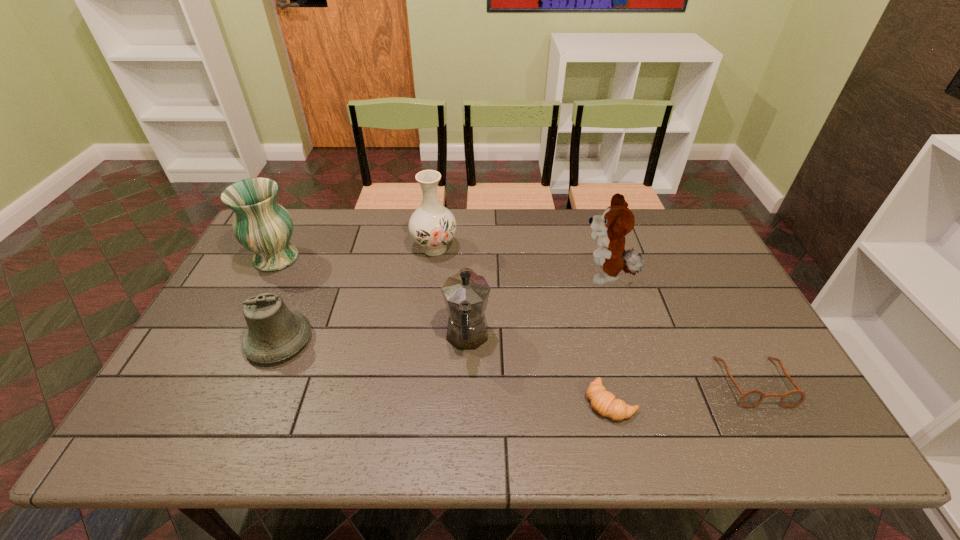
Identify the location of the right vase. (432, 226).

At what (x,y) coordinates should I click in order to perform the action: click on puppy. Please return your answer as a coordinate pair (x, y). Looking at the image, I should click on (610, 229).

What are the coordinates of `the left vase` in the screenshot? It's located at (261, 225).

Locate an element on the screen. Image resolution: width=960 pixels, height=540 pixels. coffeepot is located at coordinates (466, 294).

The height and width of the screenshot is (540, 960). What are the coordinates of `bell` in the screenshot? It's located at (274, 333).

The width and height of the screenshot is (960, 540). In order to click on the rightmost object in this screenshot , I will do `click(751, 398)`.

This screenshot has height=540, width=960. What are the coordinates of `the shortest object` in the screenshot? It's located at (604, 402).

The width and height of the screenshot is (960, 540). In order to click on free space located 0.150m on the left of the right vase in this screenshot , I will do `click(366, 248)`.

Find the location of a particular element. vacant space located on the face of the puppy is located at coordinates (462, 276).

Where is `blank space located on the face of the puppy`? The height and width of the screenshot is (540, 960). blank space located on the face of the puppy is located at coordinates (546, 276).